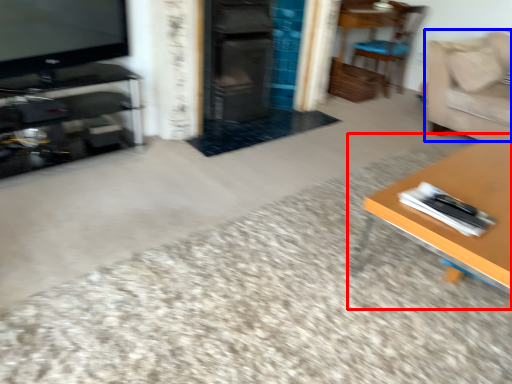
Question: Which object is further to the camera taking this photo, table (highlighted by a red box) or couch (highlighted by a blue box)?

Choices:
 (A) table
 (B) couch

Answer: (B)